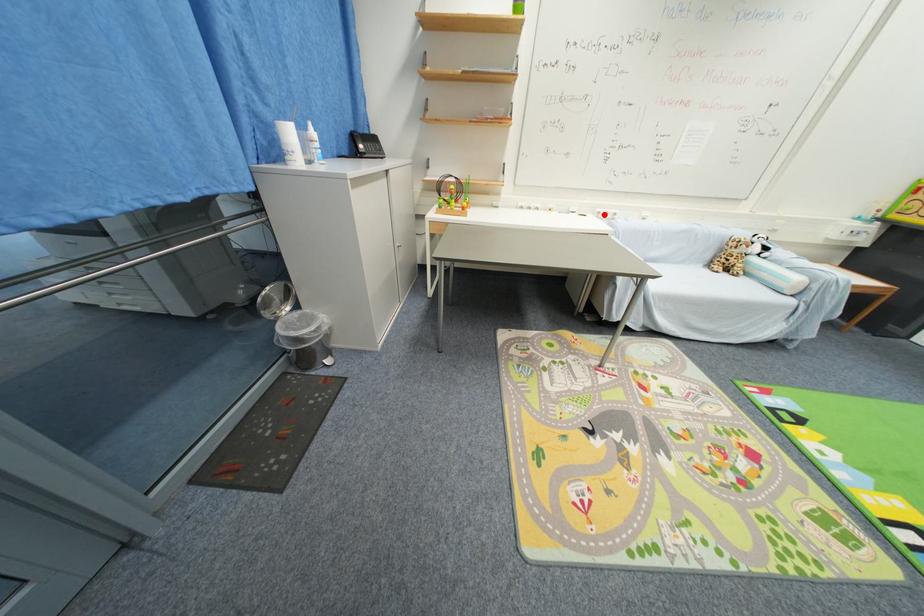
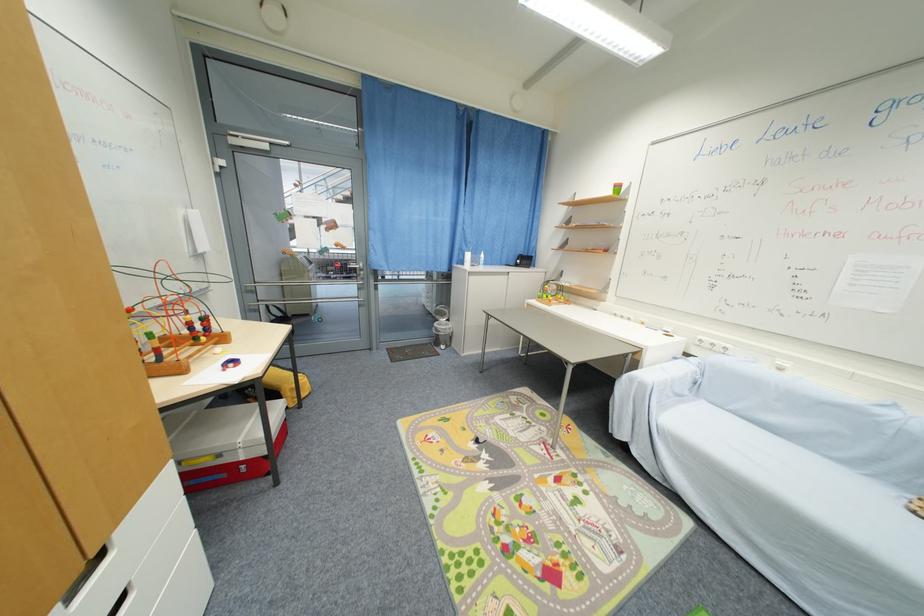
In the second image, find the point that corresponds to the highlighted location in the first image.

(706, 342)